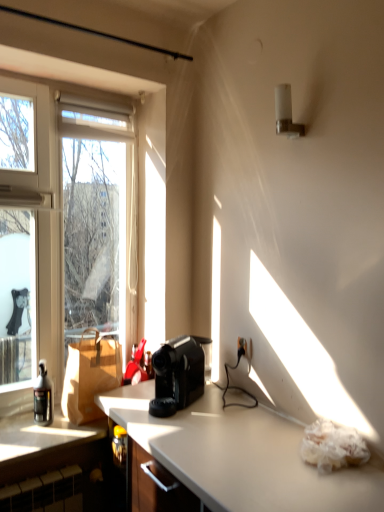
Where is `empty space that is ontop of metallic silver cabinet at left`? The width and height of the screenshot is (384, 512). empty space that is ontop of metallic silver cabinet at left is located at coordinates (54, 426).